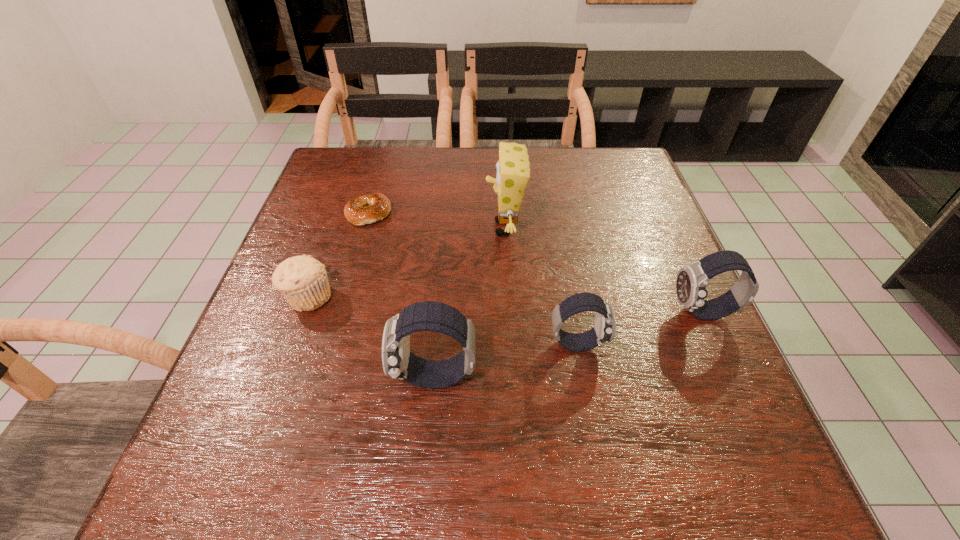
In the image, there is a desktop. What are the coordinates of `free region at the far right corner` in the screenshot? It's located at (614, 157).

Where is `vacant area that lies between the fourth object from right to left and the second watch from right to left`? This screenshot has width=960, height=540. vacant area that lies between the fourth object from right to left and the second watch from right to left is located at coordinates (506, 360).

The height and width of the screenshot is (540, 960). Identify the location of unoccupied area between the third object from left to right and the third shortest object. (506, 360).

Identify the location of empty space between the fourth object from right to left and the second shortest object. (372, 337).

Where is `vacant area between the leftmost watch and the shortest object`? The width and height of the screenshot is (960, 540). vacant area between the leftmost watch and the shortest object is located at coordinates (401, 295).

At what (x,y) coordinates should I click in order to perform the action: click on free space between the fourth object from left to right and the bagel. Please return your answer as a coordinate pair (x, y). Looking at the image, I should click on (437, 220).

What are the coordinates of `vacant space that's between the leftmost watch and the sponge` in the screenshot? It's located at (469, 302).

Where is `free point between the fifth object from left to right and the leftmost watch`? free point between the fifth object from left to right and the leftmost watch is located at coordinates (506, 360).

Image resolution: width=960 pixels, height=540 pixels. Find the location of `unoccupied area between the shortest object and the fourth tallest object`. unoccupied area between the shortest object and the fourth tallest object is located at coordinates 473,278.

The image size is (960, 540). I want to click on free spot between the fourth tallest object and the shortest object, so click(x=473, y=278).